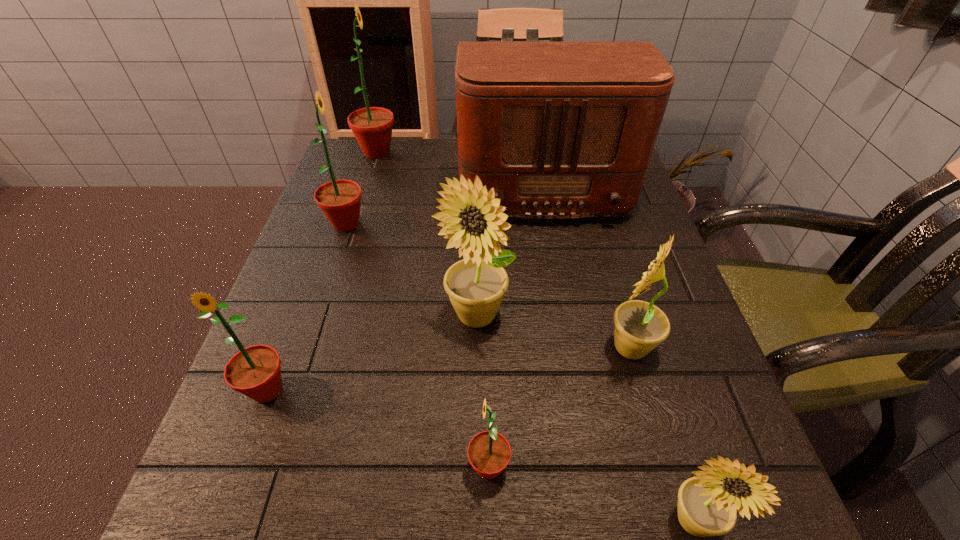
The width and height of the screenshot is (960, 540). I want to click on vacant space situated on the face of the second nearest object, so click(x=374, y=467).

At what (x,y) coordinates should I click in order to perform the action: click on sunflower positioned at the far edge. Please return your answer as a coordinate pair (x, y). The width and height of the screenshot is (960, 540). Looking at the image, I should click on (372, 127).

Find the location of a particular element. radio receiver that is at the far edge is located at coordinates (560, 130).

Where is `object at the near edge`? The image size is (960, 540). object at the near edge is located at coordinates (489, 452).

This screenshot has width=960, height=540. Identify the location of radio receiver present at the right edge. (560, 130).

Identify the location of sunflower that is at the right edge. The image size is (960, 540). (639, 326).

This screenshot has height=540, width=960. What are the coordinates of `object located at the far left corner` in the screenshot? It's located at (372, 127).

At what (x,y) coordinates should I click in order to perform the action: click on object that is at the far right corner. Please return your answer as a coordinate pair (x, y). The height and width of the screenshot is (540, 960). Looking at the image, I should click on (560, 130).

This screenshot has height=540, width=960. In the image, there is a desktop. Find the location of `blank space at the far edge`. blank space at the far edge is located at coordinates (406, 143).

Identify the location of free region at the left edge of the desktop. (328, 261).